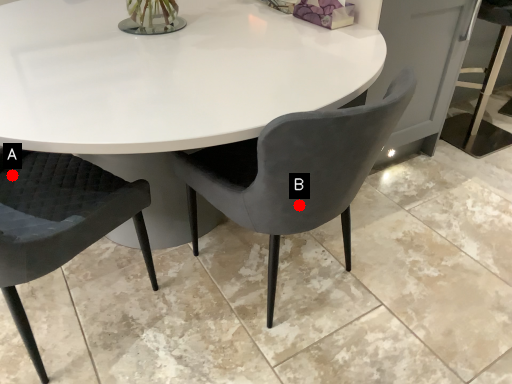
Question: Two points are circled on the image, labeled by A and B beside each circle. Which point is farther from the camera taking this photo?

Choices:
 (A) A is further
 (B) B is further

Answer: (A)